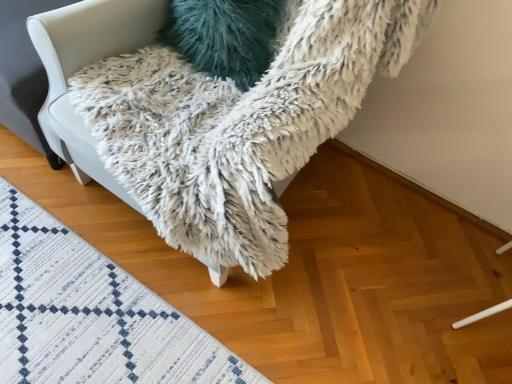
Question: From a real-world perspective, is white woven mat at lower left above or below teal fuzzy pillow at upper center?

Choices:
 (A) below
 (B) above

Answer: (A)

Question: In terms of width, does white woven mat at lower left look wider or thinner when compared to teal fuzzy pillow at upper center?

Choices:
 (A) wide
 (B) thin

Answer: (A)

Question: Which of these objects is positioned closest to the teal fuzzy pillow at upper center?

Choices:
 (A) white woven mat at lower left
 (B) white fluffy blanket at upper center

Answer: (B)

Question: Considering the real-world distances, which object is closest to the teal fuzzy pillow at upper center?

Choices:
 (A) white fluffy blanket at upper center
 (B) white woven mat at lower left

Answer: (A)